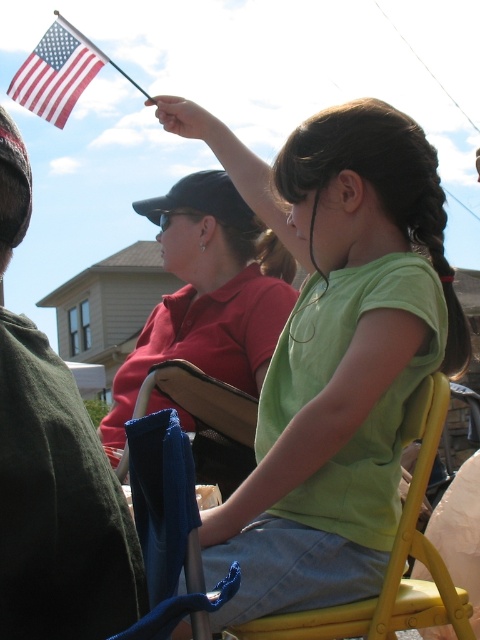
Question: Is dark green fabric at left positioned in front of yellow plastic chair at center?

Choices:
 (A) yes
 (B) no

Answer: (A)

Question: Is dark green fabric at left positioned behind red-white-blue fabric flag at upper left?

Choices:
 (A) yes
 (B) no

Answer: (B)

Question: Which of the following is the farthest from the observer?

Choices:
 (A) dark green fabric at left
 (B) red-white-blue fabric flag at upper left

Answer: (B)

Question: Is dark green fabric at left bigger than yellow plastic chair at center?

Choices:
 (A) no
 (B) yes

Answer: (A)

Question: Which object is farther from the camera taking this photo?

Choices:
 (A) dark green fabric at left
 (B) red-white-blue fabric flag at upper left
 (C) green matte shirt at center
 (D) yellow plastic chair at center

Answer: (B)

Question: Which point is closer to the camera?

Choices:
 (A) (351, 298)
 (B) (92, 528)

Answer: (B)